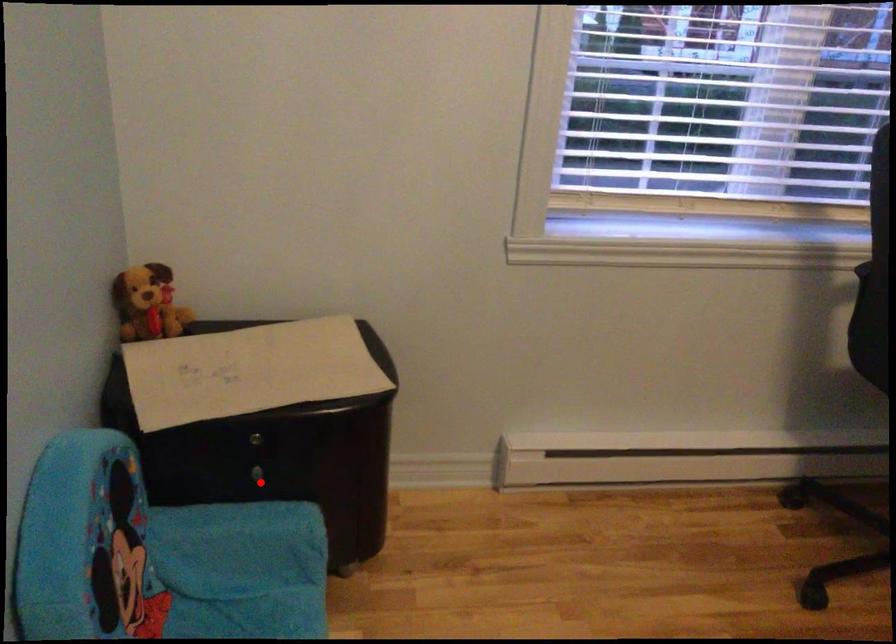
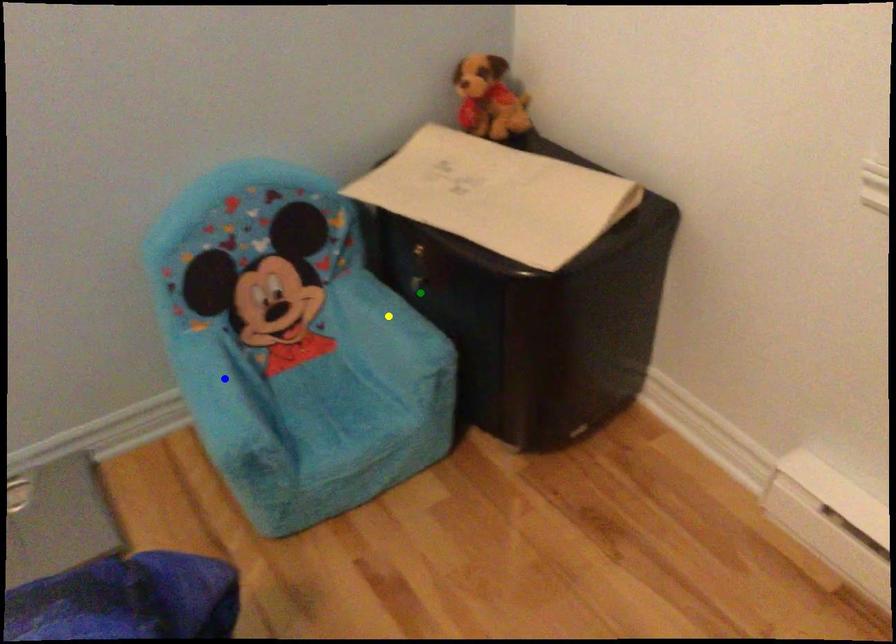
Question: I am providing you with two images of the same scene from different viewpoints. A red point is marked on the first image. You are given multiple points on the second image. Which spot in image 2 lines up with the point in image 1?

Choices:
 (A) yellow point
 (B) green point
 (C) blue point

Answer: (B)